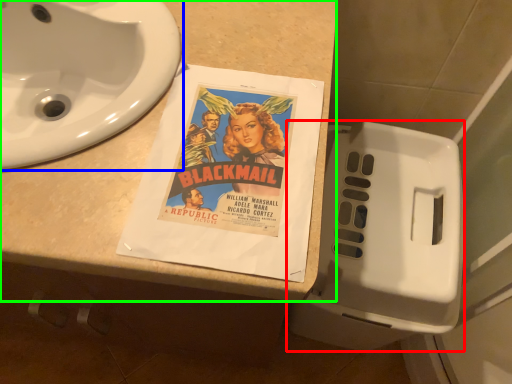
Question: Estimate the real-world distances between objects in this image. Which object is closer to toilet (highlighted by a red box), sink (highlighted by a blue box) or counter top (highlighted by a green box)?

Choices:
 (A) sink
 (B) counter top

Answer: (B)